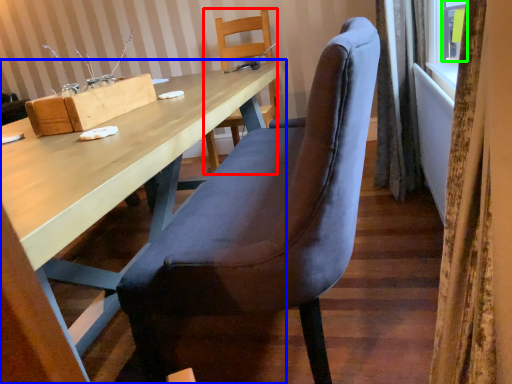
Question: Which object is the farthest from chair (highlighted by a red box)? Choose among these: desk (highlighted by a blue box) or window (highlighted by a green box).

Choices:
 (A) desk
 (B) window

Answer: (B)